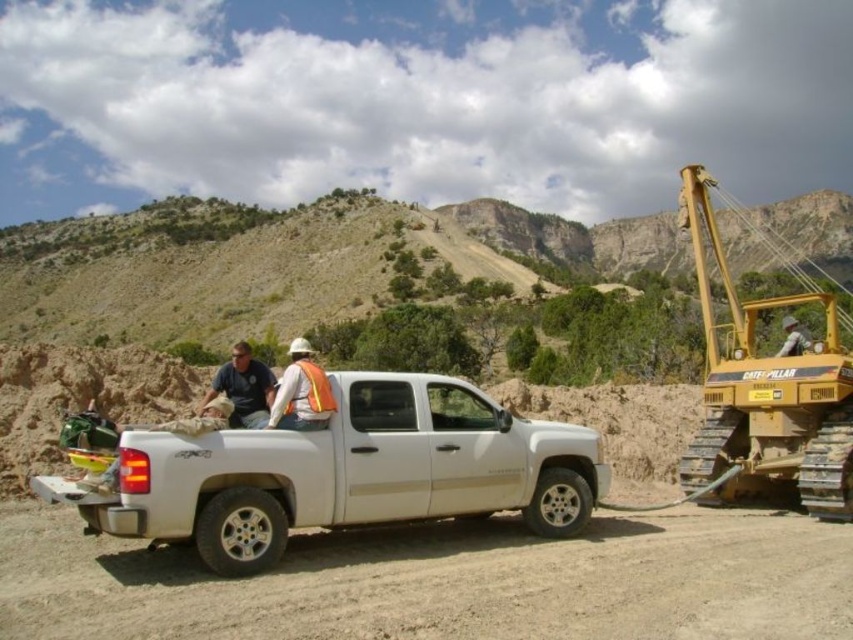
You are a safety inspector at the construction site. You need to ensure that the yellow metallic excavator at right maintains a safe distance of at least 20 meters from the orange reflective vest at center. Based on the scene, is the current distance compliant with safety regulations?

The yellow metallic excavator at right is 30.93 meters from the orange reflective vest at center, which exceeds the required 20 meters, so the distance is compliant with safety regulations.

You are standing at the construction site and want to know which of the two points, point (786, 298) or point (311, 412), is closer to you. Can you determine this based on the scene?

Point (786, 298) is closer to you than point (311, 412) because it is further to the viewer.

You are standing at the edge of the construction site and notice the brown sandy dirt track at lower center and the orange reflective vest at center. Which object is closer to the ground?

The brown sandy dirt track at lower center is closer to the ground since it is positioned below the orange reflective vest at center.